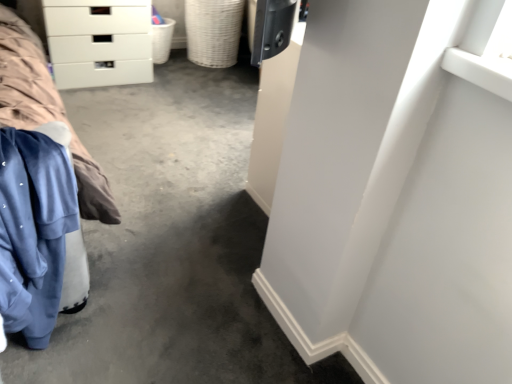
Question: Can you confirm if white plastic basket at upper left, which is the 2th basket from right to left, is bigger than white glossy chest of drawers at upper left?

Choices:
 (A) yes
 (B) no

Answer: (B)

Question: Are white plastic basket at upper left, which is the 2th basket from right to left, and white glossy chest of drawers at upper left making contact?

Choices:
 (A) no
 (B) yes

Answer: (A)

Question: From the image's perspective, is white plastic basket at upper left, the 1th basket in the left-to-right sequence, above white glossy chest of drawers at upper left?

Choices:
 (A) yes
 (B) no

Answer: (A)

Question: Is white plastic basket at upper left, which is the 2th basket from right to left, oriented away from white glossy chest of drawers at upper left?

Choices:
 (A) no
 (B) yes

Answer: (A)

Question: Is white plastic basket at upper left, which is the 2th basket from right to left, closer to camera compared to white glossy chest of drawers at upper left?

Choices:
 (A) yes
 (B) no

Answer: (B)

Question: From a real-world perspective, is woven beige basket at center, the second basket viewed from the left, positioned above or below white glossy chest of drawers at upper left?

Choices:
 (A) above
 (B) below

Answer: (B)

Question: Based on their positions, is woven beige basket at center, the second basket viewed from the left, located to the left or right of white glossy chest of drawers at upper left?

Choices:
 (A) right
 (B) left

Answer: (A)

Question: Looking at the image, does woven beige basket at center, the second basket viewed from the left, seem bigger or smaller compared to white glossy chest of drawers at upper left?

Choices:
 (A) big
 (B) small

Answer: (B)

Question: Looking at their shapes, would you say woven beige basket at center, which is counted as the first basket, starting from the right, is wider or thinner than white glossy chest of drawers at upper left?

Choices:
 (A) wide
 (B) thin

Answer: (B)

Question: Is point (146, 54) positioned closer to the camera than point (192, 51)?

Choices:
 (A) farther
 (B) closer

Answer: (B)

Question: Based on their sizes in the image, would you say white glossy chest of drawers at upper left is bigger or smaller than woven beige basket at center, which is counted as the first basket, starting from the right?

Choices:
 (A) small
 (B) big

Answer: (B)

Question: From a real-world perspective, is white glossy chest of drawers at upper left positioned above or below woven beige basket at center, the second basket viewed from the left?

Choices:
 (A) below
 (B) above

Answer: (B)

Question: Which is correct: white glossy chest of drawers at upper left is inside woven beige basket at center, which is counted as the first basket, starting from the right, or outside of it?

Choices:
 (A) outside
 (B) inside

Answer: (A)

Question: From the image's perspective, relative to white plastic basket at upper left, the 1th basket in the left-to-right sequence, is blue fleece at left above or below?

Choices:
 (A) below
 (B) above

Answer: (A)

Question: Is blue fleece at left inside the boundaries of white plastic basket at upper left, which is the 2th basket from right to left, or outside?

Choices:
 (A) outside
 (B) inside

Answer: (A)